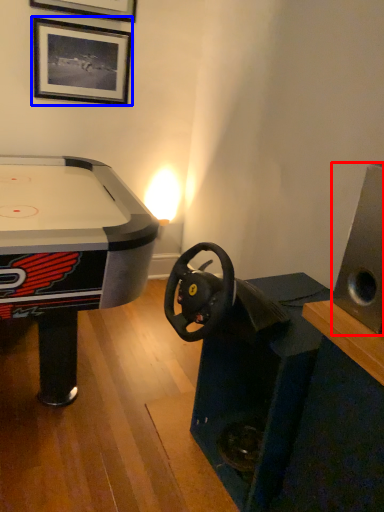
Question: Which object is further to the camera taking this photo, speaker (highlighted by a red box) or picture frame (highlighted by a blue box)?

Choices:
 (A) speaker
 (B) picture frame

Answer: (B)